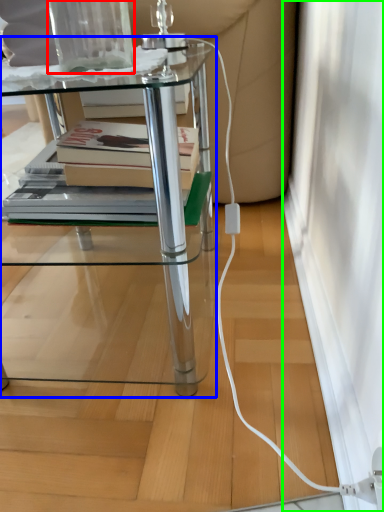
Question: Which is nearer to the glass vase (highlighted by a red box)? table (highlighted by a blue box) or screen door (highlighted by a green box).

Choices:
 (A) table
 (B) screen door

Answer: (A)